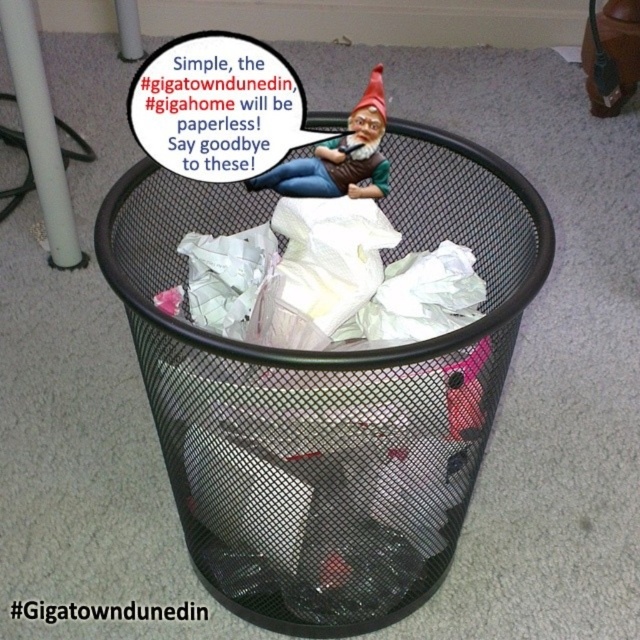
Is matte plastic gnome at upper center behind red felt gnome hat at upper center?

No, it is not.

Who is positioned more to the left, matte plastic gnome at upper center or red felt gnome hat at upper center?

From the viewer's perspective, matte plastic gnome at upper center appears more on the left side.

This screenshot has width=640, height=640. I want to click on matte plastic gnome at upper center, so click(339, 156).